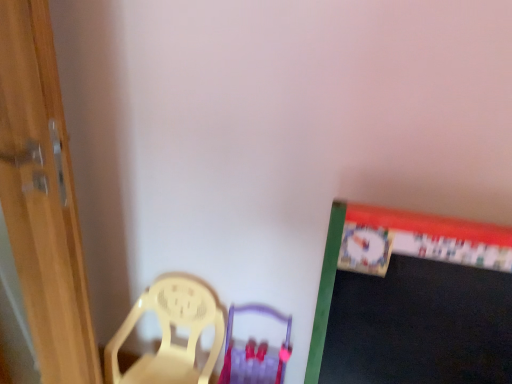
Question: Considering the relative positions of purple plastic armchair at center and wooden door at left in the image provided, is purple plastic armchair at center to the left of wooden door at left from the viewer's perspective?

Choices:
 (A) yes
 (B) no

Answer: (B)

Question: Can you confirm if purple plastic armchair at center is shorter than wooden door at left?

Choices:
 (A) no
 (B) yes

Answer: (B)

Question: Considering the relative sizes of purple plastic armchair at center and wooden door at left in the image provided, is purple plastic armchair at center taller than wooden door at left?

Choices:
 (A) no
 (B) yes

Answer: (A)

Question: Does purple plastic armchair at center have a larger size compared to wooden door at left?

Choices:
 (A) no
 (B) yes

Answer: (A)

Question: Is purple plastic armchair at center not inside wooden door at left?

Choices:
 (A) yes
 (B) no

Answer: (A)

Question: From the image's perspective, is purple plastic armchair at center on wooden door at left?

Choices:
 (A) no
 (B) yes

Answer: (A)

Question: Can you confirm if yellow plastic chair at lower left is bigger than wooden door at left?

Choices:
 (A) no
 (B) yes

Answer: (A)

Question: From a real-world perspective, is yellow plastic chair at lower left positioned over wooden door at left based on gravity?

Choices:
 (A) yes
 (B) no

Answer: (B)

Question: Is yellow plastic chair at lower left placed right next to wooden door at left?

Choices:
 (A) yes
 (B) no

Answer: (B)

Question: Is yellow plastic chair at lower left behind wooden door at left?

Choices:
 (A) yes
 (B) no

Answer: (A)

Question: From the image's perspective, is yellow plastic chair at lower left located beneath wooden door at left?

Choices:
 (A) no
 (B) yes

Answer: (B)

Question: From the image's perspective, is yellow plastic chair at lower left on top of wooden door at left?

Choices:
 (A) yes
 (B) no

Answer: (B)

Question: Does yellow plastic chair at lower left have a greater height compared to purple plastic armchair at center?

Choices:
 (A) yes
 (B) no

Answer: (A)